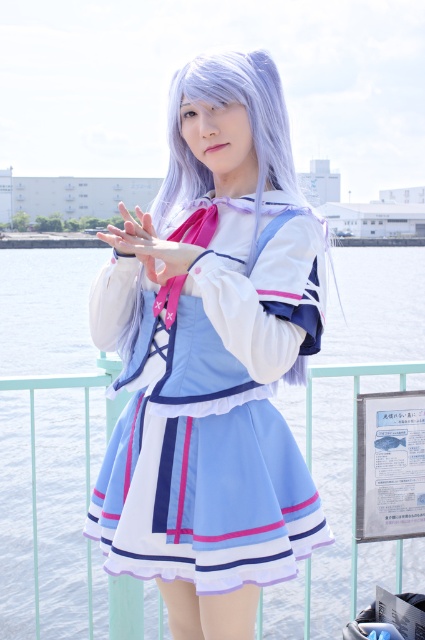
Consider the image. Who is positioned more to the left, satin blue dress at center or light blue fabric dress at center?

satin blue dress at center

Can you confirm if satin blue dress at center is thinner than light blue fabric dress at center?

Correct, satin blue dress at center's width is less than light blue fabric dress at center's.

Measure the distance between point (312, 289) and camera.

Point (312, 289) and camera are 9.71 feet apart from each other.

Locate an element on the screen. Image resolution: width=425 pixels, height=640 pixels. satin blue dress at center is located at coordinates (212, 356).